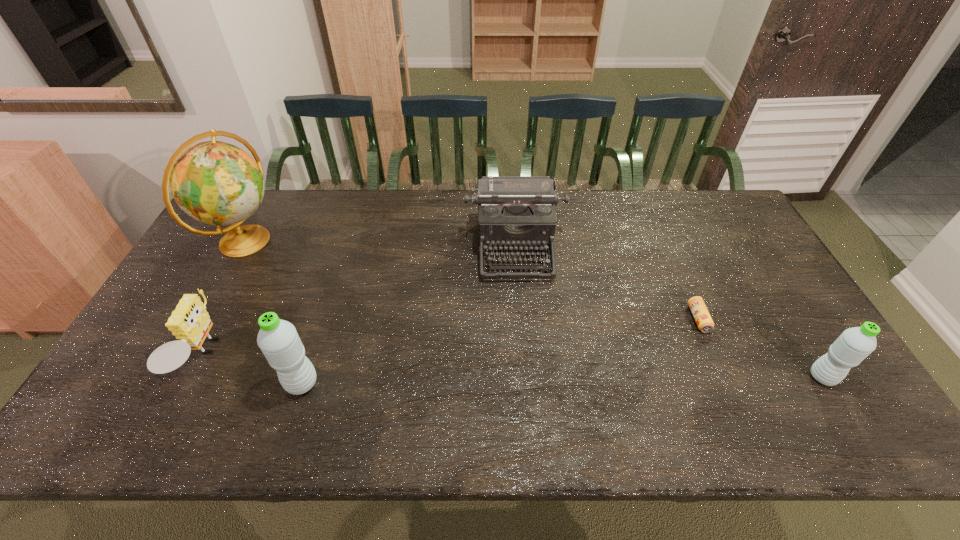
Find the location of a particular element. This screenshot has width=960, height=540. object that is positioned at the right edge is located at coordinates (854, 344).

Locate an element on the screen. The image size is (960, 540). object at the far left corner is located at coordinates (217, 183).

Locate an element on the screen. This screenshot has height=540, width=960. object at the near left corner is located at coordinates (190, 322).

Identify the location of object located at the near right corner. (854, 344).

In the image, there is a desktop. Where is `vacant space at the far edge`? vacant space at the far edge is located at coordinates (612, 214).

In order to click on vacant space at the near edge of the desktop in this screenshot , I will do `click(531, 369)`.

Locate an element on the screen. The width and height of the screenshot is (960, 540). vacant space at the left edge of the desktop is located at coordinates (223, 306).

At what (x,y) coordinates should I click in order to perform the action: click on vacant space at the right edge. Please return your answer as a coordinate pair (x, y). Looking at the image, I should click on (725, 249).

I want to click on free space at the far left corner, so click(259, 212).

Locate an element on the screen. vacant region between the third object from left to right and the second shortest object is located at coordinates (252, 370).